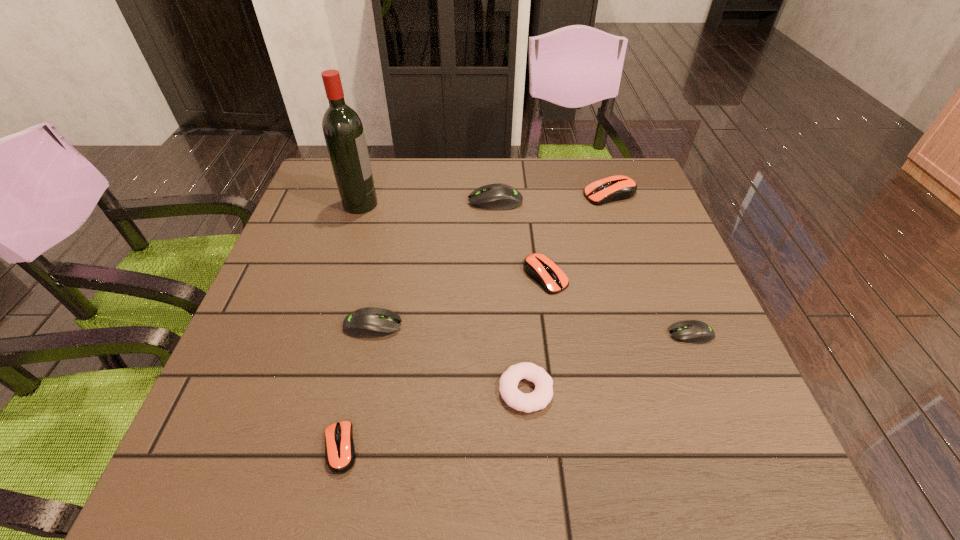
At what (x,y) coordinates should I click in order to perform the action: click on blank space located 0.180m on the wheel side of the rightmost gray computer mouse. Please return your answer as a coordinate pair (x, y). Looking at the image, I should click on (580, 334).

Where is `free space located on the wheel side of the rightmost gray computer mouse`? free space located on the wheel side of the rightmost gray computer mouse is located at coordinates (516, 334).

You are a GUI agent. You are given a task and a screenshot of the screen. Output one action in this format:
    pyautogui.click(x=<x>, y=<y>)
    Task: Click on the free point located on the wheel side of the rightmost gray computer mouse
    This screenshot has height=540, width=960.
    Given the screenshot: What is the action you would take?
    pyautogui.click(x=535, y=334)

The width and height of the screenshot is (960, 540). Identify the location of free space located on the left of the seventh farthest object. click(x=433, y=390).

What are the coordinates of `blank space located 0.070m on the right of the smallest orange computer mouse` in the screenshot? It's located at (401, 448).

Identify the location of wine bottle at the far edge. The width and height of the screenshot is (960, 540). (343, 131).

Locate an element on the screen. The width and height of the screenshot is (960, 540). object positioned at the near edge is located at coordinates (340, 454).

Where is `object at the left edge`? This screenshot has height=540, width=960. object at the left edge is located at coordinates 343,131.

In order to click on object present at the far left corner in this screenshot , I will do `click(343, 131)`.

I want to click on object present at the far right corner, so click(x=615, y=188).